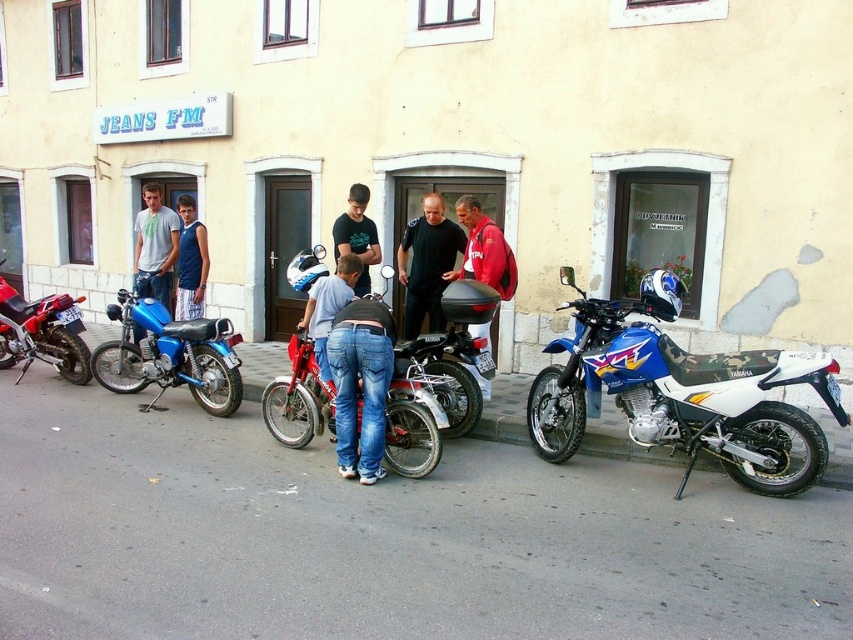
You are standing on the street in front of the JEANS FM building and see two points marked in the image. The first point is at coordinate (x=764, y=420) and the second is at (x=236, y=387). Which point is closer to you?

Point (x=764, y=420) is closer to the viewer than point (x=236, y=387).